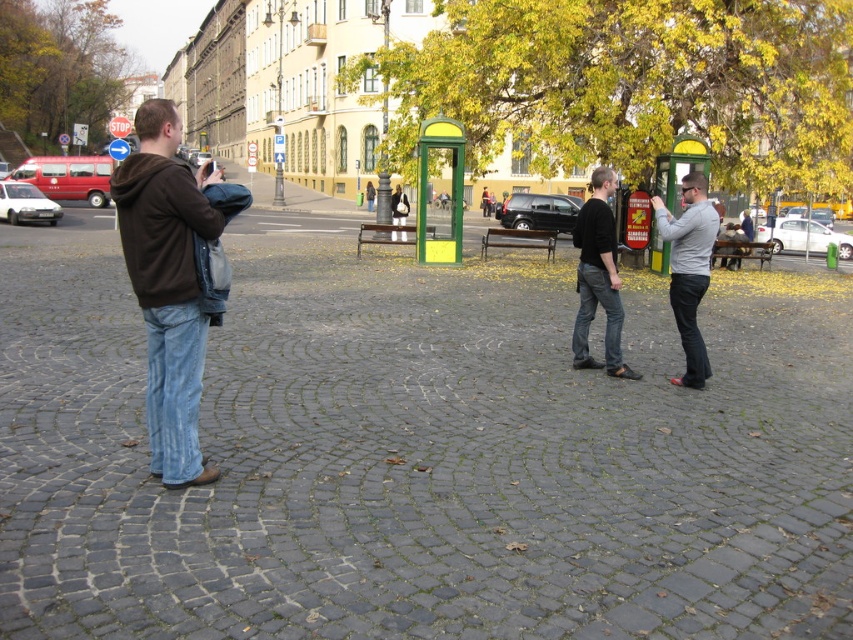
Question: Can you confirm if gray matte shirt at center is positioned to the right of black matte shirt at center?

Choices:
 (A) yes
 (B) no

Answer: (A)

Question: Which point is closer to the camera?

Choices:
 (A) gray matte shirt at center
 (B) black matte shirt at center
 (C) brown hoodie at left

Answer: (C)

Question: Observing the image, what is the correct spatial positioning of gray matte shirt at center in reference to black matte shirt at center?

Choices:
 (A) right
 (B) left

Answer: (A)

Question: Is brown hoodie at left below gray matte shirt at center?

Choices:
 (A) no
 (B) yes

Answer: (A)

Question: Among these points, which one is nearest to the camera?

Choices:
 (A) [x=590, y=225]
 (B) [x=683, y=179]

Answer: (B)

Question: Which of the following is the closest to the observer?

Choices:
 (A) brown hoodie at left
 (B) gray matte shirt at center

Answer: (A)